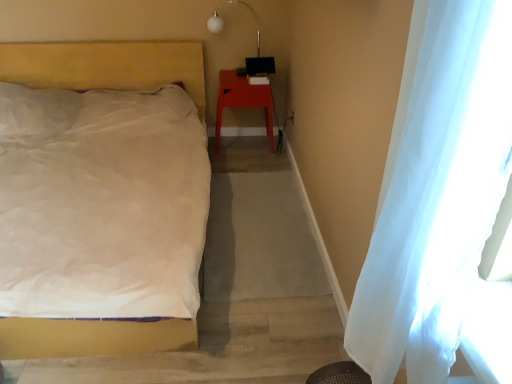
Question: From the image's perspective, is white matte bed at left located above white glass lamp at upper center?

Choices:
 (A) no
 (B) yes

Answer: (A)

Question: Can you confirm if white matte bed at left is bigger than white glass lamp at upper center?

Choices:
 (A) no
 (B) yes

Answer: (B)

Question: Is white matte bed at left wider than white glass lamp at upper center?

Choices:
 (A) yes
 (B) no

Answer: (A)

Question: Is white matte bed at left not within white glass lamp at upper center?

Choices:
 (A) no
 (B) yes

Answer: (B)

Question: Is white matte bed at left facing towards white glass lamp at upper center?

Choices:
 (A) yes
 (B) no

Answer: (B)

Question: Is white sheer curtain at right situated inside white glass lamp at upper center or outside?

Choices:
 (A) inside
 (B) outside

Answer: (B)

Question: Is white sheer curtain at right bigger or smaller than white glass lamp at upper center?

Choices:
 (A) small
 (B) big

Answer: (B)

Question: Considering the relative positions of white sheer curtain at right and white glass lamp at upper center in the image provided, is white sheer curtain at right to the left or to the right of white glass lamp at upper center?

Choices:
 (A) left
 (B) right

Answer: (B)

Question: Considering the positions of white sheer curtain at right and white glass lamp at upper center in the image, is white sheer curtain at right wider or thinner than white glass lamp at upper center?

Choices:
 (A) thin
 (B) wide

Answer: (B)

Question: From a real-world perspective, is white matte bed at left physically located above or below matte plastic stool at right?

Choices:
 (A) above
 (B) below

Answer: (A)

Question: Is white matte bed at left wider or thinner than matte plastic stool at right?

Choices:
 (A) thin
 (B) wide

Answer: (B)

Question: Considering the positions of point (161, 79) and point (226, 104), is point (161, 79) closer or farther from the camera than point (226, 104)?

Choices:
 (A) closer
 (B) farther

Answer: (B)

Question: Based on their sizes in the image, would you say white matte bed at left is bigger or smaller than matte plastic stool at right?

Choices:
 (A) small
 (B) big

Answer: (B)

Question: From the image's perspective, is white glass lamp at upper center located above or below matte plastic stool at right?

Choices:
 (A) above
 (B) below

Answer: (A)

Question: Considering the positions of white glass lamp at upper center and matte plastic stool at right in the image, is white glass lamp at upper center taller or shorter than matte plastic stool at right?

Choices:
 (A) short
 (B) tall

Answer: (A)